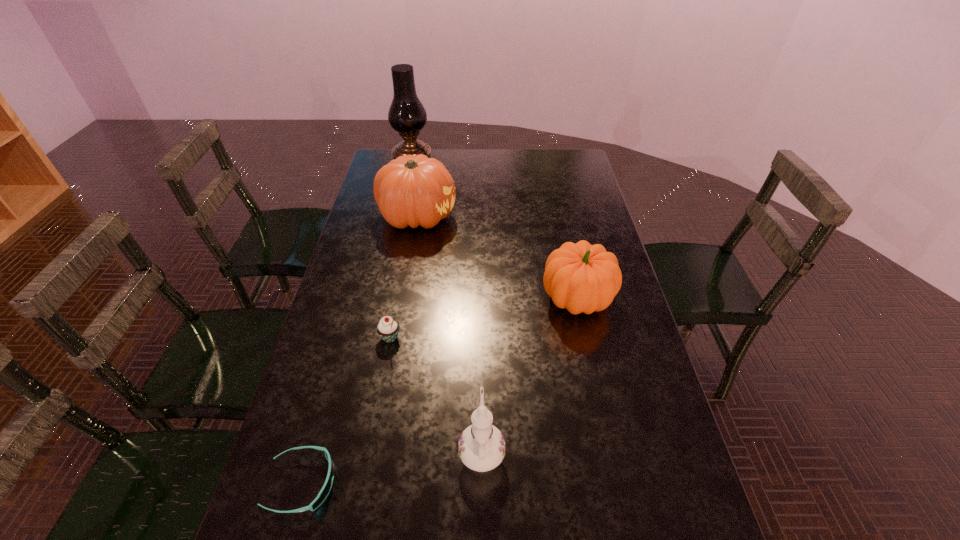
Identify the location of vacant space that is in between the taller pumpkin and the rightmost object. Image resolution: width=960 pixels, height=540 pixels. (497, 258).

Where is `vacant area that lies between the fifth object from left to right and the farther pumpkin`? The image size is (960, 540). vacant area that lies between the fifth object from left to right and the farther pumpkin is located at coordinates (449, 334).

The width and height of the screenshot is (960, 540). I want to click on vacant region between the tallest object and the shorter pumpkin, so click(494, 232).

The height and width of the screenshot is (540, 960). Identify the location of vacant area that lies between the fourth nearest object and the chinaware. (529, 375).

Locate an element on the screen. The width and height of the screenshot is (960, 540). free point between the rightmost object and the second object from right to left is located at coordinates (529, 375).

Where is `free space between the fifth nearest object and the shortest object`? The image size is (960, 540). free space between the fifth nearest object and the shortest object is located at coordinates (360, 350).

Locate an element on the screen. the third closest object relative to the right pumpkin is located at coordinates (388, 328).

At what (x,y) coordinates should I click in order to perform the action: click on object identified as the second closest to the nearer pumpkin. Please return your answer as a coordinate pair (x, y). The height and width of the screenshot is (540, 960). Looking at the image, I should click on (481, 447).

Locate an element on the screen. vacant space that satisfies the following two spatial constraints: 1. on the front side of the farthest object; 2. on the front-facing side of the shortest object is located at coordinates (346, 483).

The image size is (960, 540). What are the coordinates of `free region that satisfies the following two spatial constraints: 1. on the front side of the fifth tallest object; 2. on the front-facing side of the sunglasses` in the screenshot? It's located at tap(363, 483).